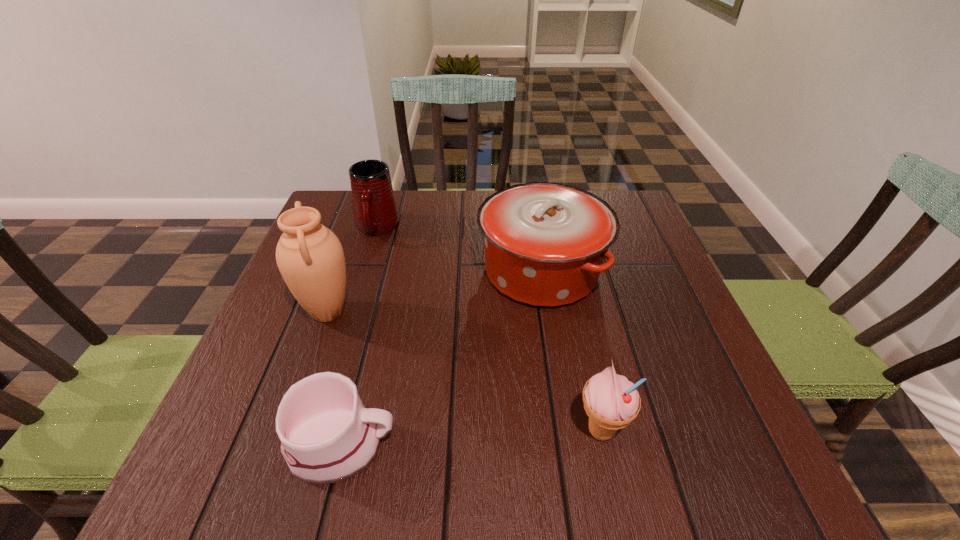
Find the location of a particular element. This screenshot has width=960, height=540. the tallest object is located at coordinates (310, 257).

The height and width of the screenshot is (540, 960). What are the coordinates of `casserole` in the screenshot? It's located at (545, 243).

Locate an element on the screen. The width and height of the screenshot is (960, 540). the farther mug is located at coordinates (375, 210).

Where is `icecream`? icecream is located at coordinates (611, 401).

You are a GUI agent. You are given a task and a screenshot of the screen. Output one action in this format:
    pyautogui.click(x=<x>, y=<y>)
    Task: Click on the nearer mug
    The height and width of the screenshot is (540, 960).
    Given the screenshot: What is the action you would take?
    pyautogui.click(x=327, y=436)

You are a GUI agent. You are given a task and a screenshot of the screen. Output one action in this format:
    pyautogui.click(x=<x>, y=<y>)
    Task: Click on the shortest object
    The width and height of the screenshot is (960, 540).
    Given the screenshot: What is the action you would take?
    pyautogui.click(x=327, y=436)

Identify the location of vacant point located 0.260m on the right of the tallest object. The image size is (960, 540). (479, 313).

Image resolution: width=960 pixels, height=540 pixels. I want to click on free space located on the right of the casserole, so click(644, 272).

In order to click on vacant space located 0.100m on the side of the taller mug with the handle in this screenshot , I will do `click(364, 272)`.

Find the location of a particular element. vacant point located 0.150m on the back of the icecream is located at coordinates (581, 342).